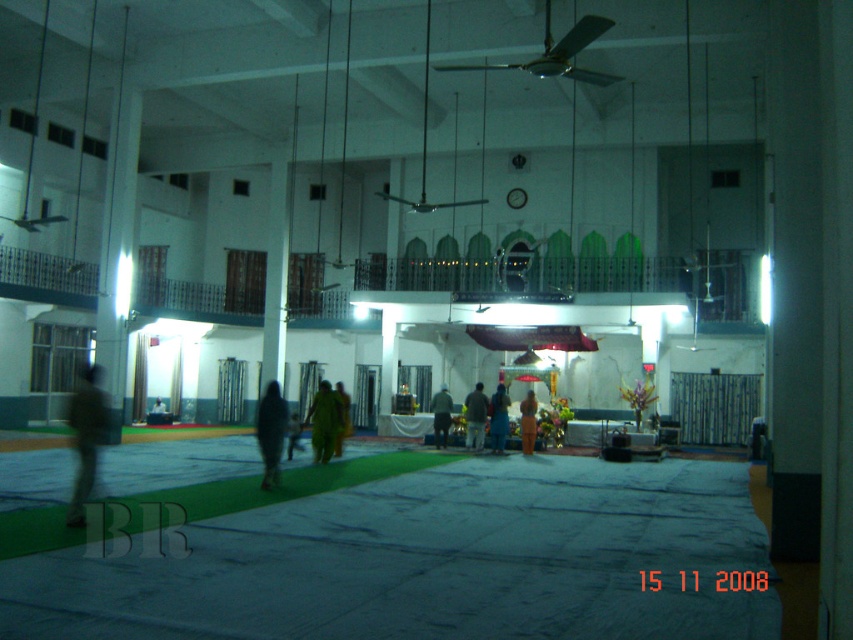
Question: Does dark matte clothing at center appear under green fabric cloth at center?

Choices:
 (A) no
 (B) yes

Answer: (A)

Question: Which of the following is the farthest from the observer?

Choices:
 (A) [x=444, y=413]
 (B) [x=90, y=376]
 (C) [x=527, y=442]
 (D) [x=334, y=456]

Answer: (A)

Question: Does dark green fabric at left come behind yellow fabric cloth at center?

Choices:
 (A) no
 (B) yes

Answer: (A)

Question: Which of the following is the farthest from the observer?

Choices:
 (A) yellow fabric cloth at center
 (B) green fabric dress at center

Answer: (A)

Question: Can you confirm if dark green fabric at left is thinner than green fabric cloth at center?

Choices:
 (A) yes
 (B) no

Answer: (B)

Question: Estimate the real-world distances between objects in this image. Which object is farther from the brown fabric cloth at center?

Choices:
 (A) dark green fabric at left
 (B) green fabric dress at center
 (C) yellow fabric cloth at center
 (D) dark matte clothing at center

Answer: (A)